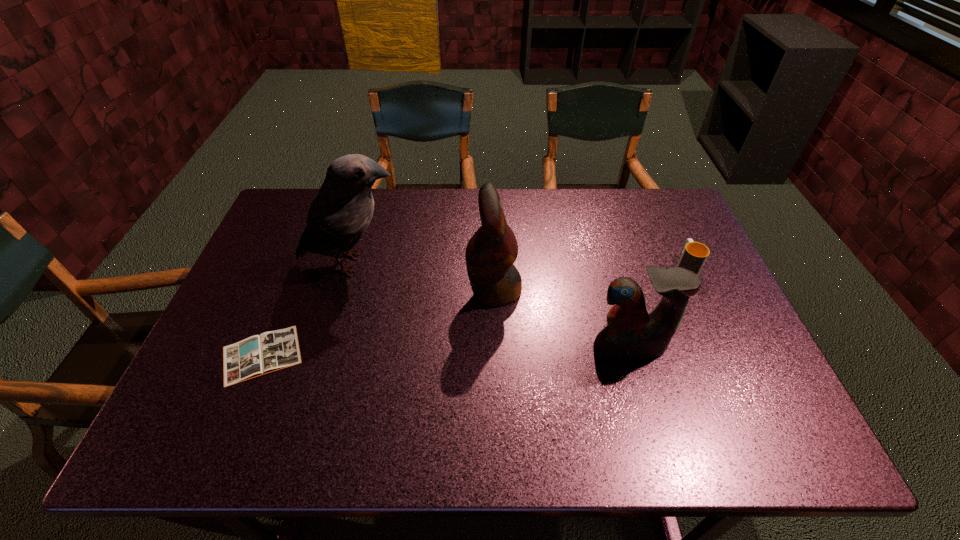
Locate an element on the screen. free space between the shortest object and the leftmost parrot is located at coordinates (307, 309).

Image resolution: width=960 pixels, height=540 pixels. What are the coordinates of `empty space that is in between the shortest object and the leftmost parrot` in the screenshot? It's located at (307, 309).

Locate an element on the screen. The image size is (960, 540). free space between the leftmost parrot and the third object from right to left is located at coordinates (423, 277).

Identify the location of object that ranks as the closest to the nearest parrot. The height and width of the screenshot is (540, 960). (490, 254).

This screenshot has height=540, width=960. Find the location of `object that is the second closest to the leftmost parrot`. object that is the second closest to the leftmost parrot is located at coordinates (490, 254).

The width and height of the screenshot is (960, 540). I want to click on parrot that is the closest one to the third object from left to right, so click(631, 333).

Choose which parrot is the nearest neighbor to the second parrot from left to right. Please provide its 2D coordinates. Your answer should be formatted as a tuple, i.e. [(x, y)], where the tuple contains the x and y coordinates of a point satisfying the conditions above.

[(631, 333)]

Find the location of a particular element. The width and height of the screenshot is (960, 540). vacant space that satisfies the following two spatial constraints: 1. on the front-facing side of the leftmost parrot; 2. on the front side of the book is located at coordinates (326, 355).

Locate an element on the screen. free space that satisfies the following two spatial constraints: 1. with the handle on the side of the cup; 2. on the front-facing side of the leftmost parrot is located at coordinates (684, 264).